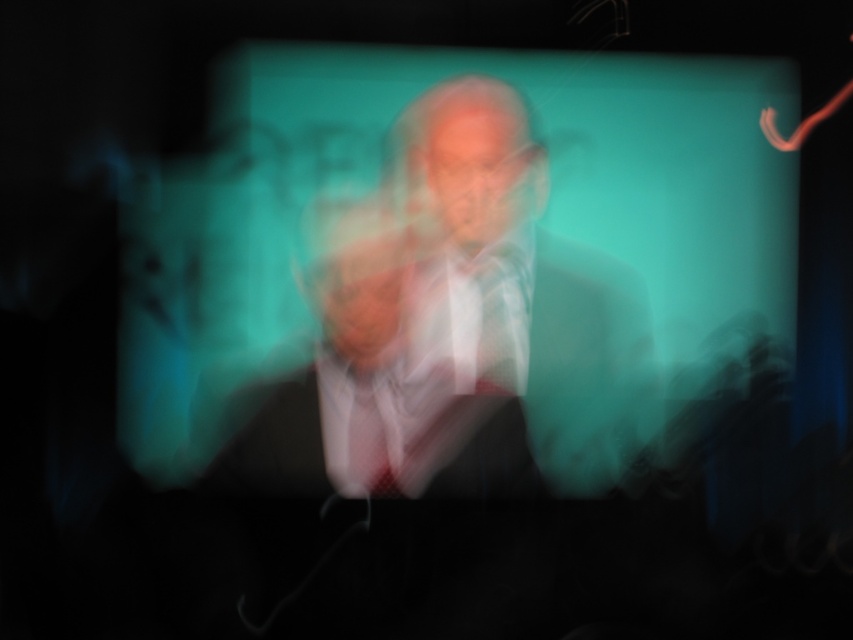
Question: Where is translucent glass screen at center located in relation to checkered fabric tie at center in the image?

Choices:
 (A) right
 (B) left

Answer: (A)

Question: In this image, where is matte black suit at center located relative to checkered fabric tie at center?

Choices:
 (A) below
 (B) above

Answer: (B)

Question: Among these objects, which one is nearest to the camera?

Choices:
 (A) matte black suit at center
 (B) black matte suit at center

Answer: (B)

Question: Is the position of matte black suit at center less distant than that of smooth black suit at center?

Choices:
 (A) no
 (B) yes

Answer: (A)

Question: Which object is the closest to the checkered fabric tie at center?

Choices:
 (A) smooth black suit at center
 (B) black matte suit at center

Answer: (B)

Question: Which of these objects is positioned closest to the checkered fabric tie at center?

Choices:
 (A) black matte suit at center
 (B) translucent glass screen at center

Answer: (A)